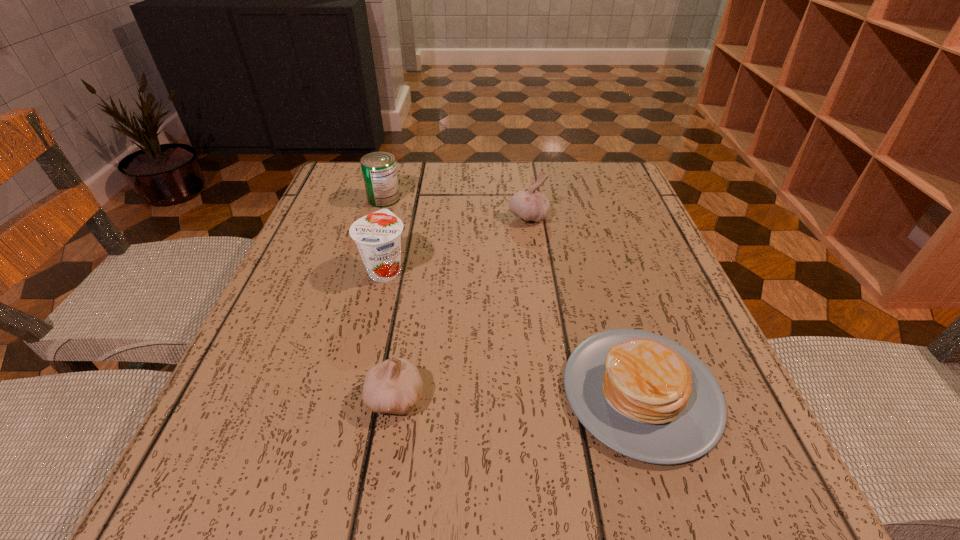
Where is `vacant space located 0.300m on the back of the nearer garlic`? The image size is (960, 540). vacant space located 0.300m on the back of the nearer garlic is located at coordinates (420, 251).

Identify the location of blank space located 0.140m on the back of the shortest object. (605, 278).

Identify the location of garlic that is at the far edge. (530, 205).

Identify the location of can located in the far edge section of the desktop. (379, 171).

Where is `object that is at the near edge`? Image resolution: width=960 pixels, height=540 pixels. object that is at the near edge is located at coordinates (646, 397).

Locate an element on the screen. can positioned at the left edge is located at coordinates (379, 171).

Locate an element on the screen. yogurt located in the left edge section of the desktop is located at coordinates (378, 235).

Where is `object present at the right edge`? The width and height of the screenshot is (960, 540). object present at the right edge is located at coordinates (646, 397).

Find the location of a particular element. The image size is (960, 540). object at the far left corner is located at coordinates (379, 171).

Find the location of a particular element. The width and height of the screenshot is (960, 540). object situated at the near right corner is located at coordinates (646, 397).